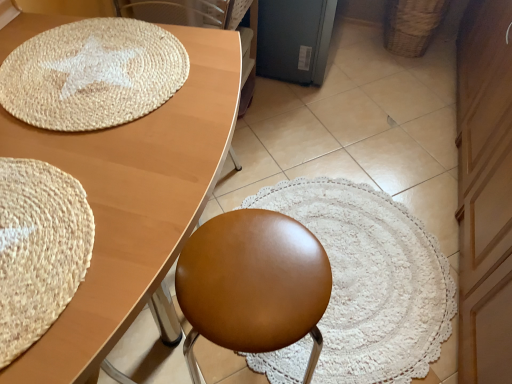
Question: Does brown leather swivel chair at upper center appear on the right side of natural fiber mat at upper left, which ranks as the second mat in bottom-to-top order?

Choices:
 (A) yes
 (B) no

Answer: (A)

Question: Does brown leather swivel chair at upper center have a larger size compared to natural fiber mat at upper left, the first mat when ordered from back to front?

Choices:
 (A) no
 (B) yes

Answer: (B)

Question: Is there a large distance between brown leather swivel chair at upper center and natural fiber mat at upper left, which is the first mat in top-to-bottom order?

Choices:
 (A) no
 (B) yes

Answer: (A)

Question: Is brown leather swivel chair at upper center with natural fiber mat at upper left, which ranks as the second mat in bottom-to-top order?

Choices:
 (A) no
 (B) yes

Answer: (A)

Question: Is brown leather swivel chair at upper center facing towards natural fiber mat at upper left, which is the first mat in top-to-bottom order?

Choices:
 (A) no
 (B) yes

Answer: (B)

Question: Is wooden dresser at right taller or shorter than brown leather swivel chair at upper center?

Choices:
 (A) tall
 (B) short

Answer: (A)

Question: In terms of width, does wooden dresser at right look wider or thinner when compared to brown leather swivel chair at upper center?

Choices:
 (A) thin
 (B) wide

Answer: (B)

Question: Is wooden dresser at right inside or outside of brown leather swivel chair at upper center?

Choices:
 (A) inside
 (B) outside

Answer: (B)

Question: Considering the positions of point (497, 137) and point (138, 4), is point (497, 137) closer or farther from the camera than point (138, 4)?

Choices:
 (A) farther
 (B) closer

Answer: (A)

Question: From the image's perspective, is natural fiber mat at upper left, which is the second mat in front-to-back order, above or below brown leather swivel chair at upper center?

Choices:
 (A) above
 (B) below

Answer: (B)

Question: Considering the positions of natural fiber mat at upper left, the first mat when ordered from back to front, and brown leather swivel chair at upper center in the image, is natural fiber mat at upper left, the first mat when ordered from back to front, taller or shorter than brown leather swivel chair at upper center?

Choices:
 (A) tall
 (B) short

Answer: (B)

Question: Is point (8, 109) closer or farther from the camera than point (175, 14)?

Choices:
 (A) closer
 (B) farther

Answer: (A)

Question: In terms of size, does natural fiber mat at upper left, which is the second mat in front-to-back order, appear bigger or smaller than brown leather swivel chair at upper center?

Choices:
 (A) big
 (B) small

Answer: (B)

Question: From the image's perspective, relative to beige woven mat at lower left, arranged as the 1th mat when ordered from the bottom, is brown leather swivel chair at upper center above or below?

Choices:
 (A) below
 (B) above

Answer: (B)

Question: Is brown leather swivel chair at upper center spatially inside beige woven mat at lower left, which is the 2th mat in back-to-front order, or outside of it?

Choices:
 (A) outside
 (B) inside

Answer: (A)